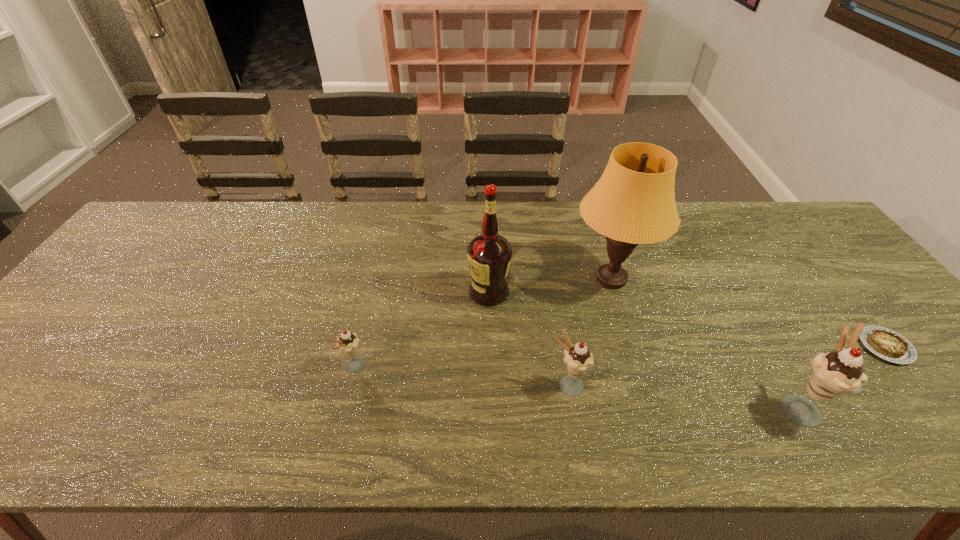
Where is `free space that satisfies the following two spatial constraints: 1. on the label of the alcohol; 2. on the back side of the quiche`? Image resolution: width=960 pixels, height=540 pixels. free space that satisfies the following two spatial constraints: 1. on the label of the alcohol; 2. on the back side of the quiche is located at coordinates (490, 347).

Find the location of a particular element. This screenshot has width=960, height=540. vacant space that satisfies the following two spatial constraints: 1. on the back side of the rightmost object; 2. on the left side of the second icecream from right to left is located at coordinates (562, 347).

This screenshot has height=540, width=960. What are the coordinates of `blank space that satisfies the following two spatial constraints: 1. on the label of the third shortest object; 2. on the right side of the second object from left to right` in the screenshot? It's located at (491, 386).